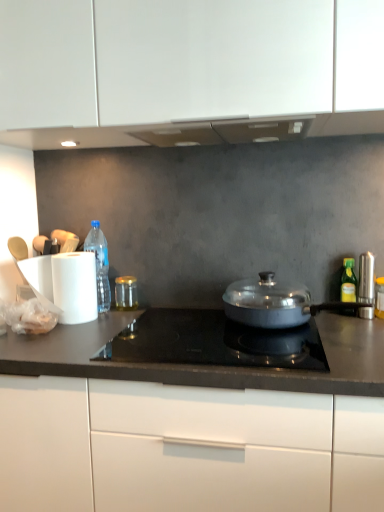
Question: Looking at the image, does translucent plastic bottle at left, marked as the 2th bottle in a front-to-back arrangement, seem bigger or smaller compared to yellow-green glass bottle at right, which is the second bottle in left-to-right order?

Choices:
 (A) big
 (B) small

Answer: (A)

Question: Looking at their shapes, would you say translucent plastic bottle at left, which is counted as the second bottle, starting from the right, is wider or thinner than yellow-green glass bottle at right, the second bottle when ordered from back to front?

Choices:
 (A) thin
 (B) wide

Answer: (B)

Question: Estimate the real-world distances between objects in this image. Which object is closer to the satin silver canister at right?

Choices:
 (A) metallic gray pan at center
 (B) satin black cooktop at center
 (C) yellow-green glass bottle at right, positioned as the 1th bottle in front-to-back order
 (D) translucent plastic bottle at left, the first bottle from the back
 (E) white matte cabinet at center

Answer: (C)

Question: Which object is the farthest from the yellow-green glass bottle at right, the first bottle positioned from the right?

Choices:
 (A) satin silver canister at right
 (B) translucent plastic bottle at left, marked as the 2th bottle in a front-to-back arrangement
 (C) white matte cabinet at center
 (D) metallic gray pan at center
 (E) satin black cooktop at center

Answer: (B)